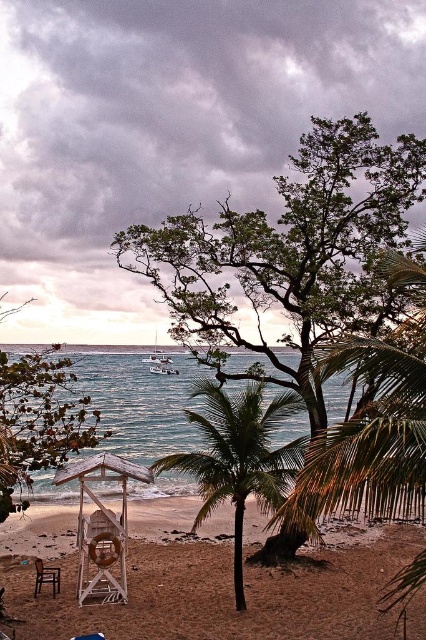
In the scene shown: Is green leafy tree at center closer to the viewer compared to wooden beach chair at lower left?

No.

Does green leafy tree at center have a smaller size compared to wooden beach chair at lower left?

Yes, green leafy tree at center is smaller than wooden beach chair at lower left.

Does point (385, 189) lie behind point (58, 579)?

Yes, point (385, 189) is behind point (58, 579).

Identify the location of green leafy tree at center. The height and width of the screenshot is (640, 426). [290, 253].

Can you confirm if white plastic lifeguard chair at lower center is thinner than wooden beach chair at lower left?

In fact, white plastic lifeguard chair at lower center might be wider than wooden beach chair at lower left.

In the scene shown: Does white plastic lifeguard chair at lower center appear under wooden beach chair at lower left?

Correct, white plastic lifeguard chair at lower center is located below wooden beach chair at lower left.

Which is behind, point (45, 600) or point (36, 589)?

The point (36, 589) is more distant.

Where is `white plastic lifeguard chair at lower center`? white plastic lifeguard chair at lower center is located at coordinates (207, 588).

Is point (284, 404) positioned after point (51, 584)?

No, (284, 404) is in front of (51, 584).

Is green leafy palm tree at center thinner than wooden beach chair at lower left?

Incorrect, green leafy palm tree at center's width is not less than wooden beach chair at lower left's.

Is point (193, 467) in front of point (48, 580)?

Yes.

Locate an element on the screen. Image resolution: width=426 pixels, height=640 pixels. green leafy palm tree at center is located at coordinates (238, 458).